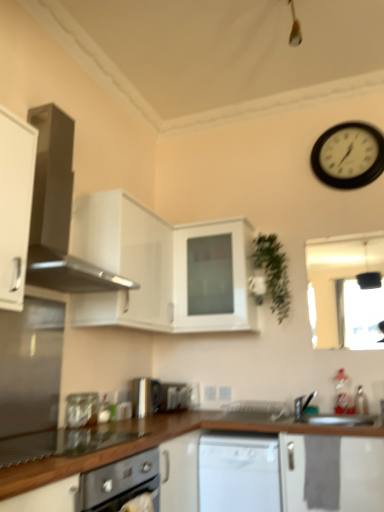
Question: From the image's perspective, is satin black range hood at upper left on top of black plastic wall clock at upper right?

Choices:
 (A) yes
 (B) no

Answer: (B)

Question: Considering the relative sizes of satin black range hood at upper left and black plastic wall clock at upper right in the image provided, is satin black range hood at upper left shorter than black plastic wall clock at upper right?

Choices:
 (A) no
 (B) yes

Answer: (A)

Question: Is satin black range hood at upper left not close to black plastic wall clock at upper right?

Choices:
 (A) yes
 (B) no

Answer: (A)

Question: Does satin black range hood at upper left have a greater height compared to black plastic wall clock at upper right?

Choices:
 (A) no
 (B) yes

Answer: (B)

Question: Is the position of satin black range hood at upper left less distant than that of black plastic wall clock at upper right?

Choices:
 (A) no
 (B) yes

Answer: (B)

Question: Is satin black range hood at upper left smaller than black plastic wall clock at upper right?

Choices:
 (A) no
 (B) yes

Answer: (A)

Question: From a real-world perspective, is white glossy dishwasher at center beneath black plastic wall clock at upper right?

Choices:
 (A) yes
 (B) no

Answer: (A)

Question: Would you say black plastic wall clock at upper right is part of white glossy dishwasher at center's contents?

Choices:
 (A) no
 (B) yes

Answer: (A)

Question: Is white glossy dishwasher at center taller than black plastic wall clock at upper right?

Choices:
 (A) yes
 (B) no

Answer: (A)

Question: Considering the relative sizes of white glossy dishwasher at center and black plastic wall clock at upper right in the image provided, is white glossy dishwasher at center bigger than black plastic wall clock at upper right?

Choices:
 (A) yes
 (B) no

Answer: (A)

Question: Is white glossy dishwasher at center facing away from black plastic wall clock at upper right?

Choices:
 (A) no
 (B) yes

Answer: (A)

Question: Does white glossy dishwasher at center have a greater width compared to black plastic wall clock at upper right?

Choices:
 (A) yes
 (B) no

Answer: (A)

Question: Is green matte plant at upper right not inside satin silver toaster at center, the first appliance viewed from the back?

Choices:
 (A) yes
 (B) no

Answer: (A)